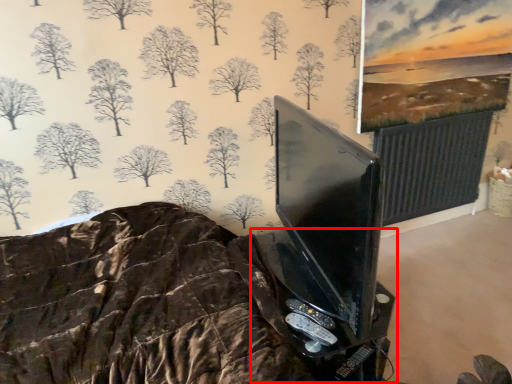
Question: From the image's perspective, what is the correct spatial positioning of table (annotated by the red box) in reference to game controller?

Choices:
 (A) below
 (B) above

Answer: (A)